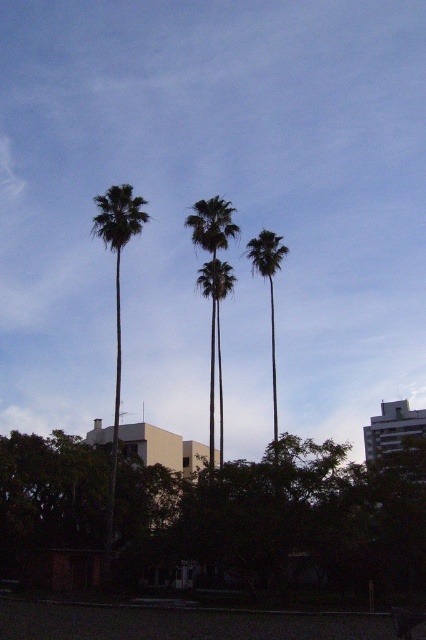
Looking at this image, you are standing at the center of the image and want to locate the green leafy palm tree at left. According to the coordinates provided, in which direction should you look to find it?

The green leafy palm tree at left is located at coordinates point [117,296]. Since the x coordinate is 0.463, which is less than 0.5, it is positioned to the left of the center. Therefore, you should look to the left to find it.